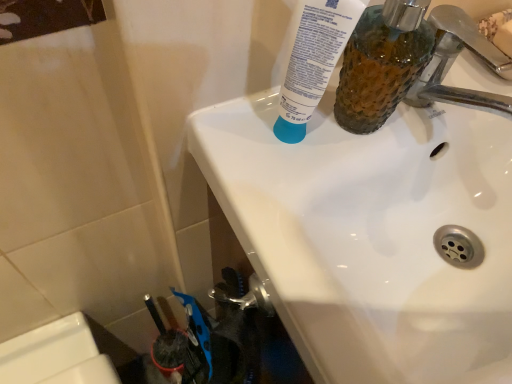
Question: Is point (482, 104) positioned closer to the camera than point (498, 249)?

Choices:
 (A) farther
 (B) closer

Answer: (B)

Question: Considering their positions, is chrome metallic faucet at upper right located in front of or behind white glossy sink at upper center?

Choices:
 (A) front
 (B) behind

Answer: (B)

Question: Which object is positioned closest to the white glossy sink at upper center?

Choices:
 (A) chrome metallic faucet at upper right
 (B) translucent textured mouthwash at upper right
 (C) white matte tube at upper center

Answer: (B)

Question: Considering the real-world distances, which object is farthest from the white matte tube at upper center?

Choices:
 (A) white glossy sink at upper center
 (B) chrome metallic faucet at upper right
 (C) translucent textured mouthwash at upper right

Answer: (B)